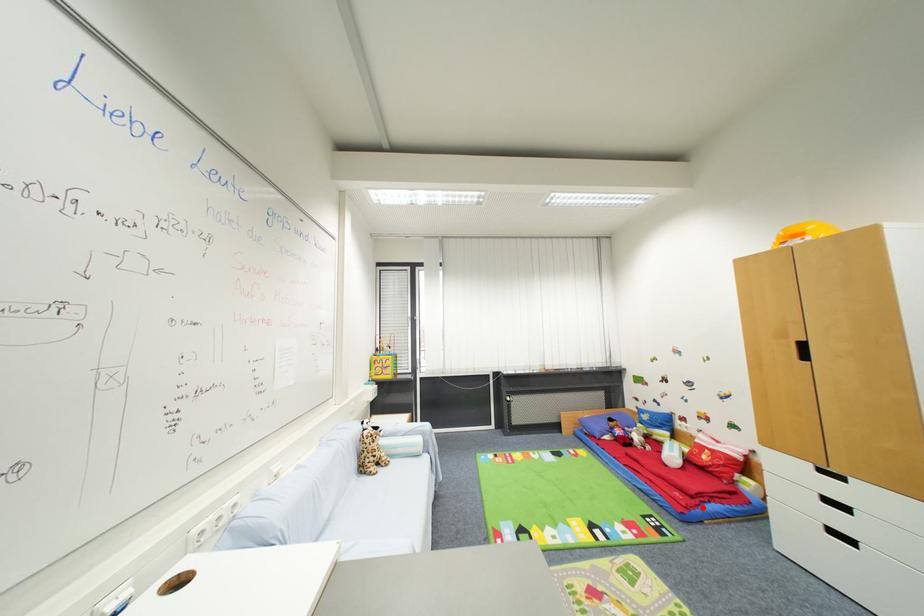
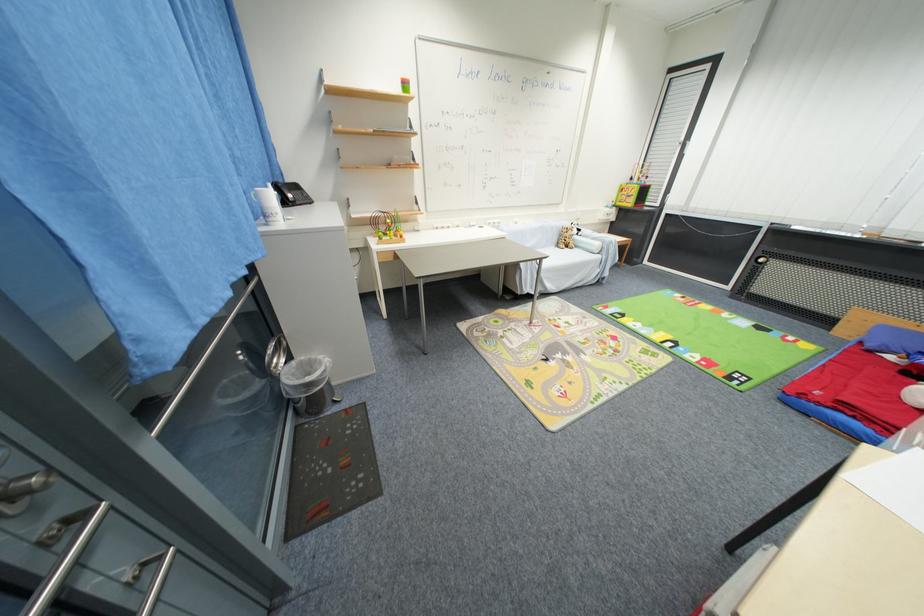
Locate, in the second image, the point that corresponds to the highlighted location in the first image.

(824, 406)